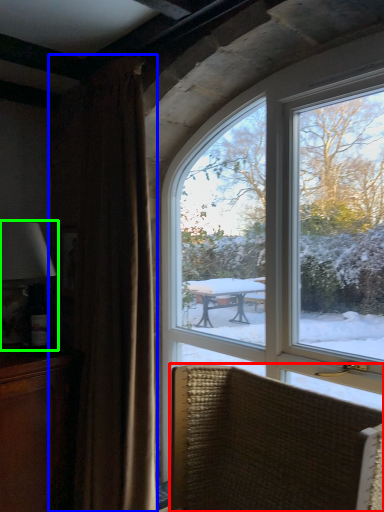
Question: Which object is positioned farthest from chair (highlighted by a red box)? Select from curtain (highlighted by a blue box) and table lamp (highlighted by a green box).

Choices:
 (A) curtain
 (B) table lamp

Answer: (B)